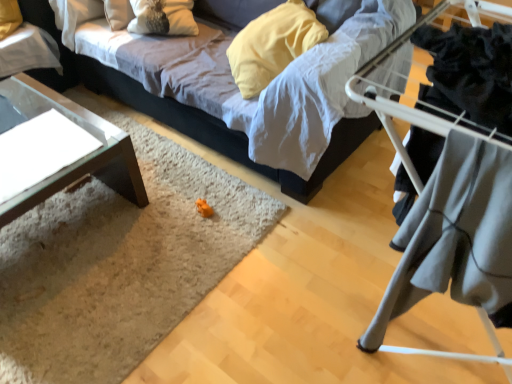
Question: Considering the relative positions of gray fabric at right and velvet fabric couch at center in the image provided, is gray fabric at right to the left or to the right of velvet fabric couch at center?

Choices:
 (A) right
 (B) left

Answer: (A)

Question: From their relative heights in the image, would you say gray fabric at right is taller or shorter than velvet fabric couch at center?

Choices:
 (A) short
 (B) tall

Answer: (A)

Question: Which object is positioned farthest from the gray fabric at right?

Choices:
 (A) clear glass table at upper left, arranged as the 1th table when viewed from the top
 (B) transparent glass table at lower left, which is the 1th table in bottom-to-top order
 (C) velvet fabric couch at center

Answer: (A)

Question: Considering the real-world distances, which object is closest to the transparent glass table at lower left, which is the second table from top to bottom?

Choices:
 (A) velvet fabric couch at center
 (B) clear glass table at upper left, arranged as the 1th table when viewed from the top
 (C) gray fabric at right

Answer: (B)